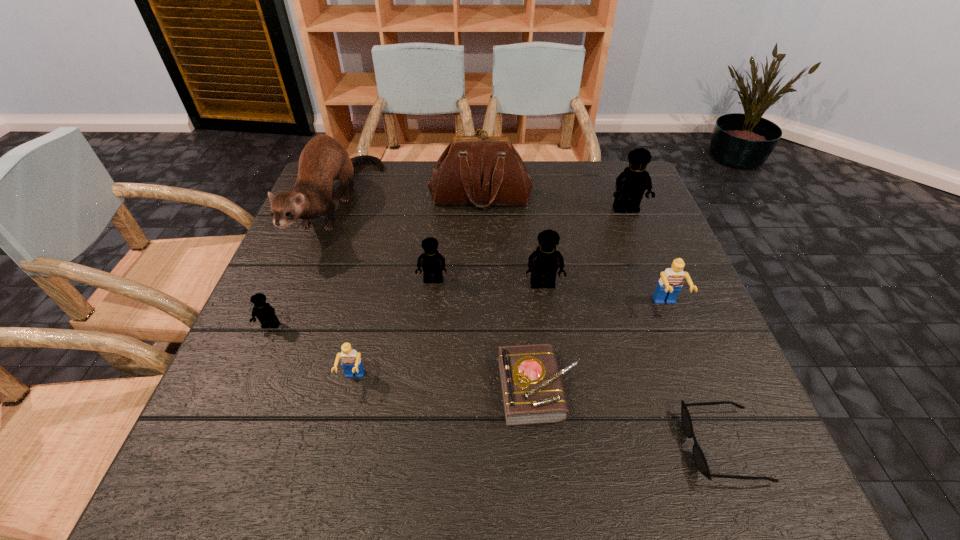
The image size is (960, 540). Find the location of `the leftmost yellow Lego`. the leftmost yellow Lego is located at coordinates (265, 313).

What are the coordinates of `the nearest yellow Lego` in the screenshot? It's located at (265, 313).

Locate an element on the screen. the left blue Lego is located at coordinates (351, 362).

This screenshot has width=960, height=540. What are the coordinates of `the smaller blue Lego` in the screenshot? It's located at (351, 362).

Where is `the second shortest object`? The height and width of the screenshot is (540, 960). the second shortest object is located at coordinates (532, 390).

In order to click on sunglasses in this screenshot , I will do `click(698, 455)`.

The image size is (960, 540). In order to click on the shortest object in this screenshot , I will do `click(698, 455)`.

Where is `vacant space located on the left of the brown shoulder bag`? vacant space located on the left of the brown shoulder bag is located at coordinates (373, 198).

Locate an element on the screen. The image size is (960, 540). vacant space located at the face of the brown ferret is located at coordinates (278, 368).

Identify the location of free region located 0.100m on the front-facing side of the biggest yellow Lego. (638, 242).